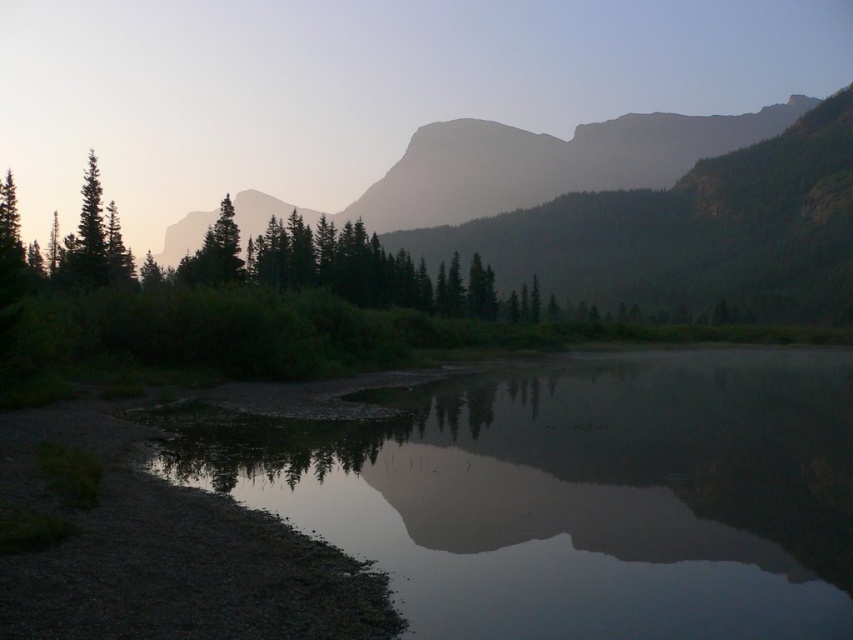
Question: Can you confirm if smooth reflective water at center is wider than green matte tree at left?

Choices:
 (A) no
 (B) yes

Answer: (A)

Question: Is smooth reflective water at center behind silvery gray rock at upper center?

Choices:
 (A) no
 (B) yes

Answer: (A)

Question: Which is nearer to the smooth reflective water at center?

Choices:
 (A) silvery gray rock at upper center
 (B) green matte tree at left

Answer: (B)

Question: Can you confirm if smooth reflective water at center is positioned to the right of green matte tree at left?

Choices:
 (A) no
 (B) yes

Answer: (B)

Question: Which object is farther from the camera taking this photo?

Choices:
 (A) silvery gray rock at upper center
 (B) smooth reflective water at center

Answer: (A)

Question: Which of the following is the farthest from the observer?

Choices:
 (A) smooth reflective water at center
 (B) green matte tree at left

Answer: (B)